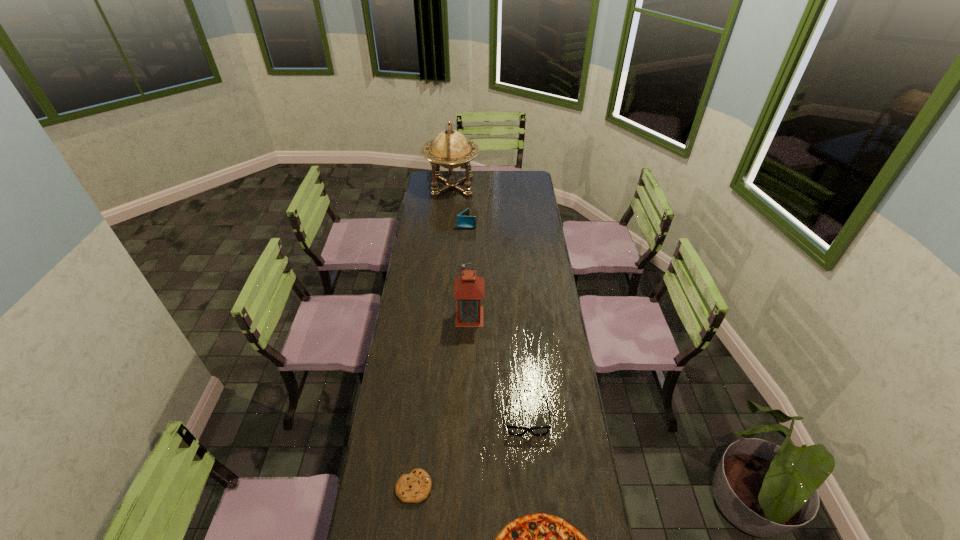
At what (x,y) coordinates should I click in order to perform the action: click on object that is at the far left corner. Please return your answer as a coordinate pair (x, y). Looking at the image, I should click on (450, 149).

The height and width of the screenshot is (540, 960). Identify the location of vacant space at the far edge of the desktop. (464, 184).

Identify the location of blank area at the left edge. The height and width of the screenshot is (540, 960). (387, 471).

Find the location of a particular element. free space at the right edge of the desktop is located at coordinates (538, 329).

In the image, there is a desktop. At what (x,y) coordinates should I click in order to perform the action: click on free region at the far left corner. Please return your answer as a coordinate pair (x, y). The height and width of the screenshot is (540, 960). Looking at the image, I should click on (437, 179).

Find the location of a particular element. This screenshot has width=960, height=540. empty location between the third nearest object and the igniter is located at coordinates (495, 348).

Identify the location of empty space between the second shortest object and the globe. (433, 336).

Locate an element on the screen. The image size is (960, 540). free area in between the sixth nearest object and the farthest object is located at coordinates (460, 205).

Locate an element on the screen. The height and width of the screenshot is (540, 960). free point between the lantern and the third shortest object is located at coordinates (498, 367).

This screenshot has height=540, width=960. In order to click on free point between the third farthest object and the second nearest object in this screenshot , I will do `click(439, 382)`.